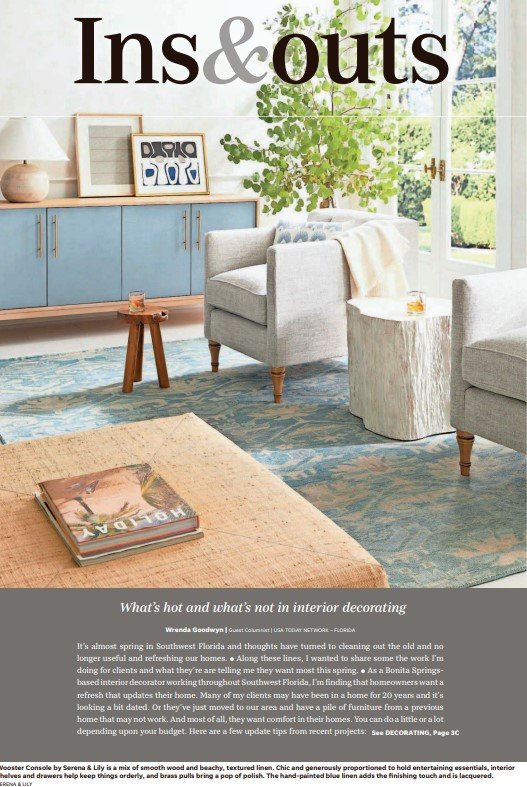
Locate an element on the screen. furniture legs is located at coordinates (154, 335), (136, 370), (126, 367), (212, 350), (275, 375), (472, 446).